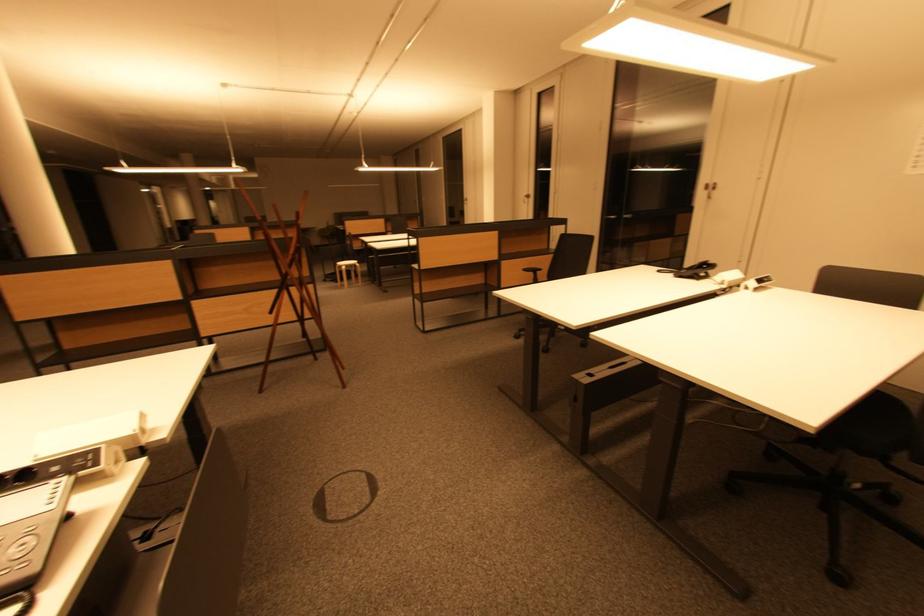
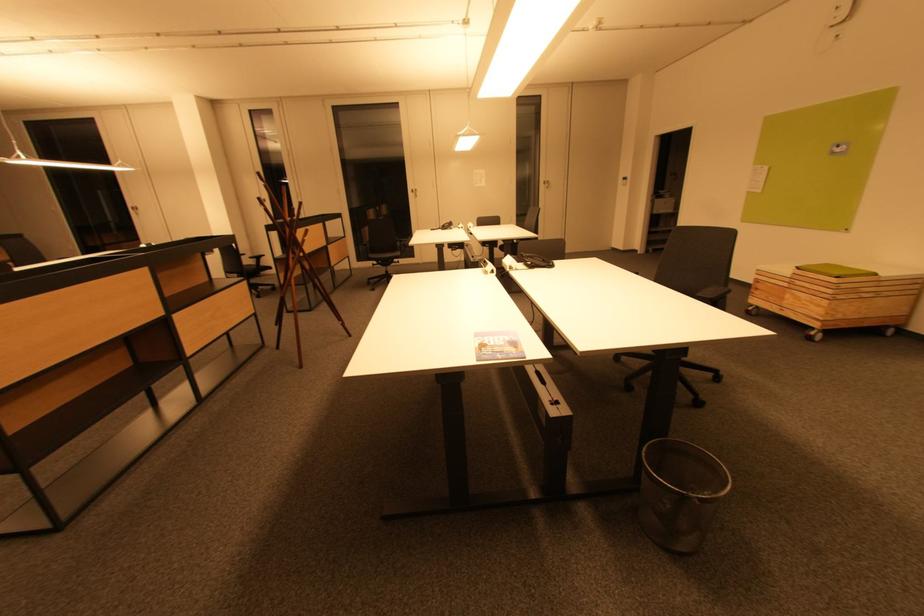
Find the pixel in the second image that matches (718,185) in the first image.

(419, 191)